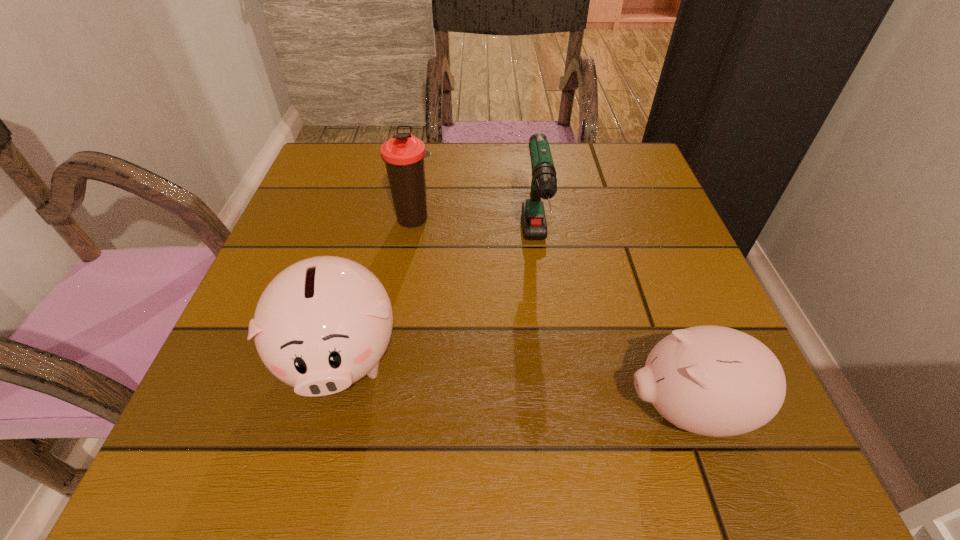
This screenshot has height=540, width=960. In order to click on vacant space at the far right corner in this screenshot , I will do `click(620, 188)`.

Where is `free point between the shortest object and the thermos bottle`? free point between the shortest object and the thermos bottle is located at coordinates tap(551, 314).

Where is `empty space between the thermos bottle and the second object from right to left`? empty space between the thermos bottle and the second object from right to left is located at coordinates (475, 232).

Locate an element on the screen. The image size is (960, 540). vacant area between the right piggy bank and the drill is located at coordinates (612, 327).

Identify the location of vacant space that's between the thermos bottle and the rightmost object. This screenshot has width=960, height=540. (551, 314).

Locate an element on the screen. The height and width of the screenshot is (540, 960). empty space between the drill and the shorter piggy bank is located at coordinates (612, 327).

This screenshot has height=540, width=960. What are the coordinates of `vacant space in between the shortest object and the taller piggy bank` in the screenshot? It's located at (515, 382).

What are the coordinates of `empty space between the rightmost object and the left piggy bank` in the screenshot? It's located at (515, 382).

Find the location of `object that is the third closest to the thermos bottle`. object that is the third closest to the thermos bottle is located at coordinates (716, 381).

Identify which object is the second nearest to the drill. Please provide its 2D coordinates. Your answer should be formatted as a tuple, i.e. [(x, y)], where the tuple contains the x and y coordinates of a point satisfying the conditions above.

[(716, 381)]